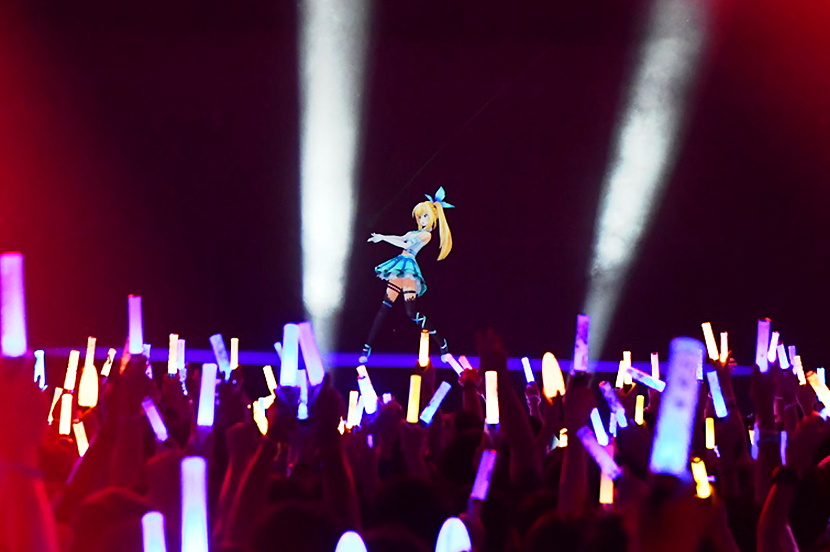
Image resolution: width=830 pixels, height=552 pixels. Identify the location of stockings. (370, 336), (420, 321).